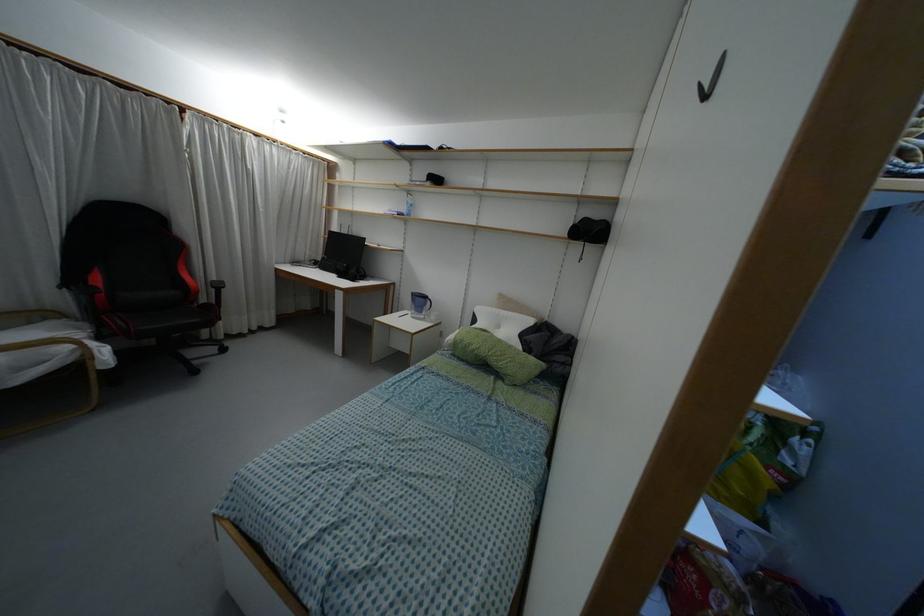
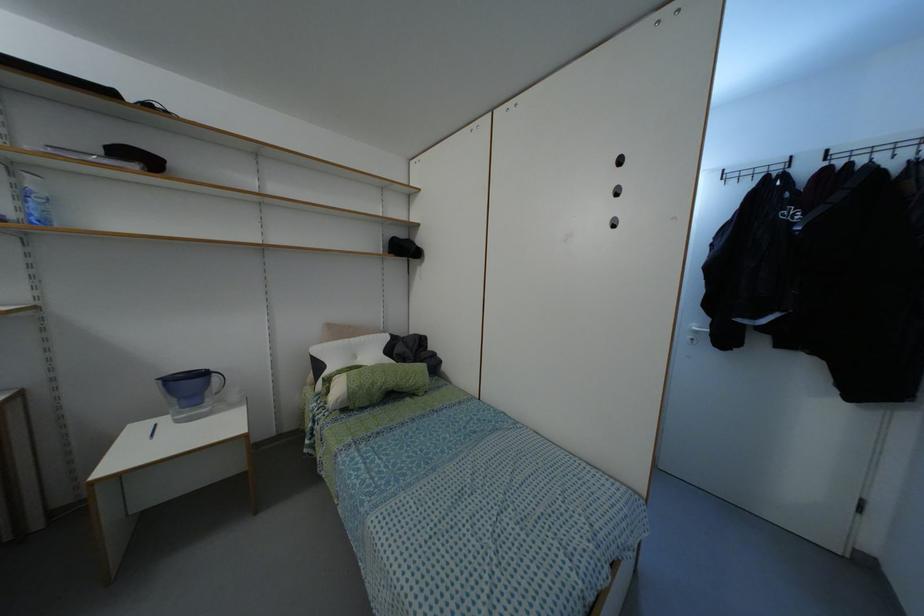
The point at (468, 344) is marked in the first image. Where is the corresponding point in the second image?

(371, 384)